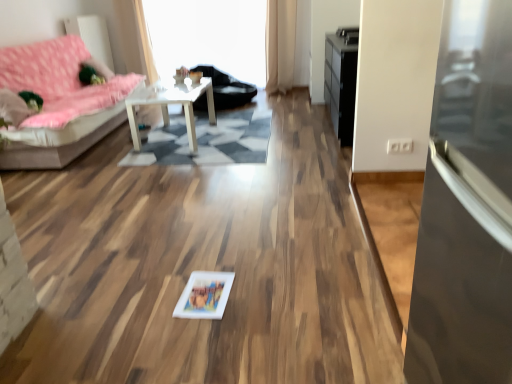
Identify the location of free space that is in between black glossy dresser at upper right and white glossy picture frame at center. (286, 184).